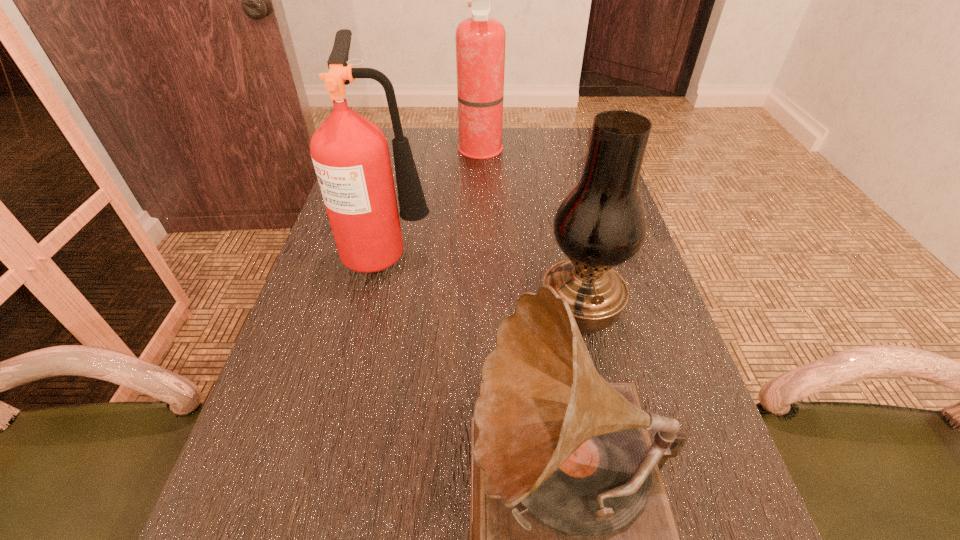
Identify the location of the right fire extinguisher. This screenshot has height=540, width=960. (480, 40).

This screenshot has height=540, width=960. I want to click on the farthest object, so click(x=480, y=40).

At what (x,y) coordinates should I click in order to perform the action: click on the second farthest object. Please return your answer as a coordinate pair (x, y). The width and height of the screenshot is (960, 540). Looking at the image, I should click on (350, 154).

Image resolution: width=960 pixels, height=540 pixels. What are the coordinates of `the nearer fire extinguisher` in the screenshot? It's located at (350, 154).

At what (x,y) coordinates should I click in order to perform the action: click on oil lamp. Please return your answer as a coordinate pair (x, y). Looking at the image, I should click on point(600,224).

Find the location of a particular element. The width and height of the screenshot is (960, 540). vacant space situated with the handle and hose on the farthest object is located at coordinates (439, 151).

You are a GUI agent. You are given a task and a screenshot of the screen. Output one action in this format:
    pyautogui.click(x=<x>, y=<y>)
    Task: Click on the free location located 0.100m with the handle and hose on the farthest object
    This screenshot has height=540, width=960.
    Given the screenshot: What is the action you would take?
    pyautogui.click(x=426, y=151)

Locate an element on the screen. The height and width of the screenshot is (540, 960). vacant area located 0.220m with the handle and hose on the farthest object is located at coordinates (389, 151).

Locate an element on the screen. free point located 0.360m at the nozzle of the nearer fire extinguisher is located at coordinates (584, 252).

Locate an element on the screen. The image size is (960, 540). vacant space located 0.340m on the back of the oil lamp is located at coordinates (555, 197).